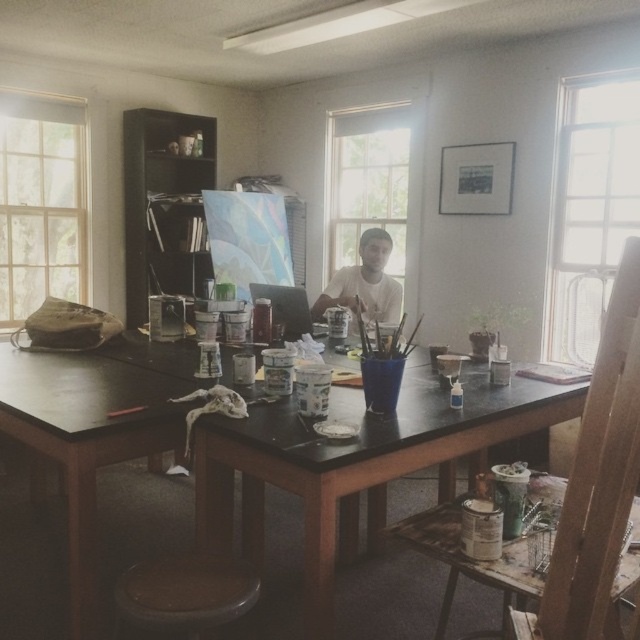
Does black matte table at center appear on the left side of brown wooden stool at lower center?

Indeed, black matte table at center is positioned on the left side of brown wooden stool at lower center.

Does black matte table at center appear under brown wooden stool at lower center?

No, black matte table at center is not below brown wooden stool at lower center.

Is point (552, 385) farther from viewer compared to point (221, 596)?

Yes, it is.

Where is `black matte table at center`? black matte table at center is located at coordinates (376, 454).

Between black matte table at center and white matte shirt at center, which one appears on the right side from the viewer's perspective?

From the viewer's perspective, white matte shirt at center appears more on the right side.

Is black matte table at center to the left of white matte shirt at center from the viewer's perspective?

Indeed, black matte table at center is positioned on the left side of white matte shirt at center.

I want to click on black matte table at center, so click(376, 454).

Where is `black matte table at center`? The width and height of the screenshot is (640, 640). black matte table at center is located at coordinates (376, 454).

Does brown wooden stool at lower center have a greater height compared to white matte shirt at center?

No.

Between point (129, 570) and point (381, 305), which one is positioned in front?

Positioned in front is point (129, 570).

Locate an element on the screen. brown wooden stool at lower center is located at coordinates (186, 593).